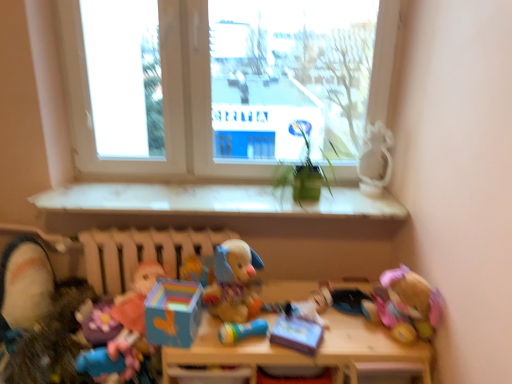
This screenshot has width=512, height=384. In order to click on vacant space positioned to the left of rubber duck at center, which is counted as the fourth toy, starting from the right in this screenshot , I will do `click(207, 336)`.